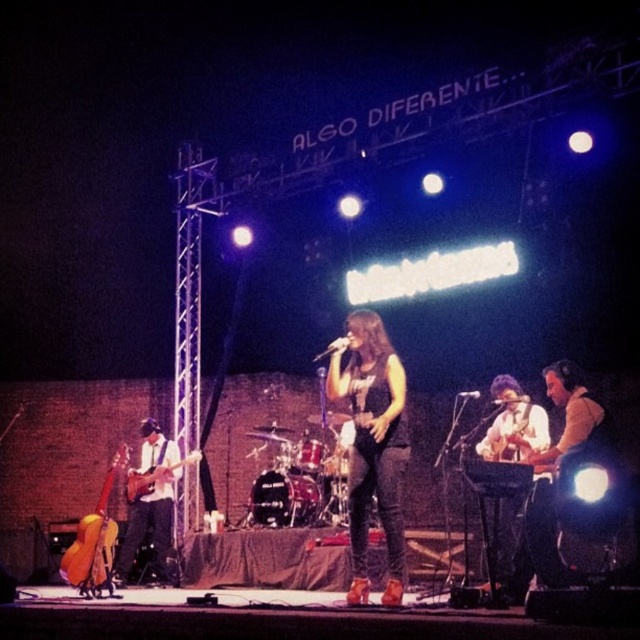
Question: Which of the following is the closest to the observer?

Choices:
 (A) light brown leather jacket at right
 (B) matte electric guitar at left
 (C) smooth brown guitar at center

Answer: (A)

Question: Which object is closer to the camera taking this photo?

Choices:
 (A) smooth brown guitar at center
 (B) light brown leather jacket at right

Answer: (B)

Question: Does matte black guitar at left lie in front of matte electric guitar at left?

Choices:
 (A) no
 (B) yes

Answer: (B)

Question: Does smooth brown guitar at center come behind matte black guitar at left?

Choices:
 (A) yes
 (B) no

Answer: (B)

Question: Does light brown leather jacket at right appear under matte black guitar at left?

Choices:
 (A) yes
 (B) no

Answer: (B)

Question: Which object is positioned closest to the wooden acoustic guitar at left?

Choices:
 (A) matte electric guitar at left
 (B) black leather pants at center
 (C) smooth brown guitar at center

Answer: (A)